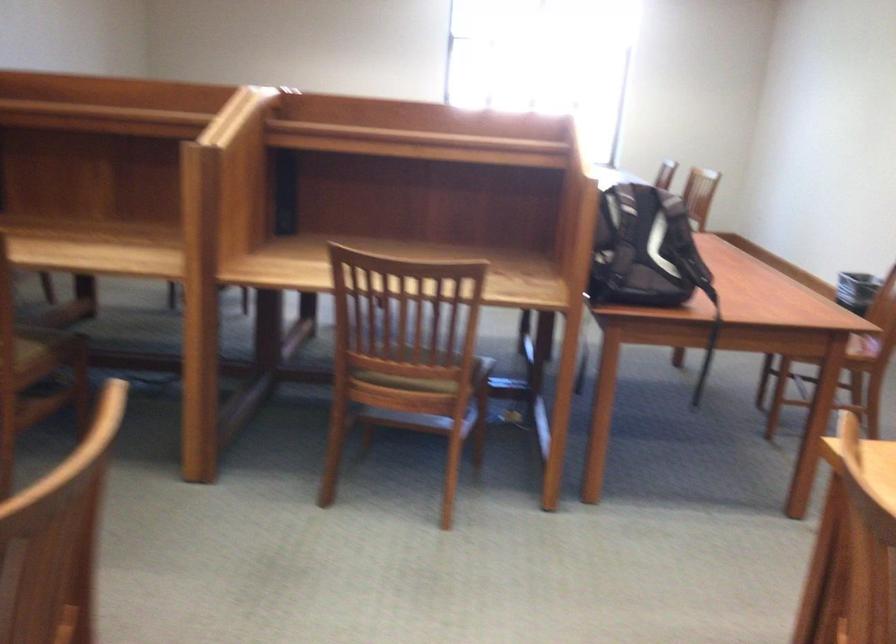
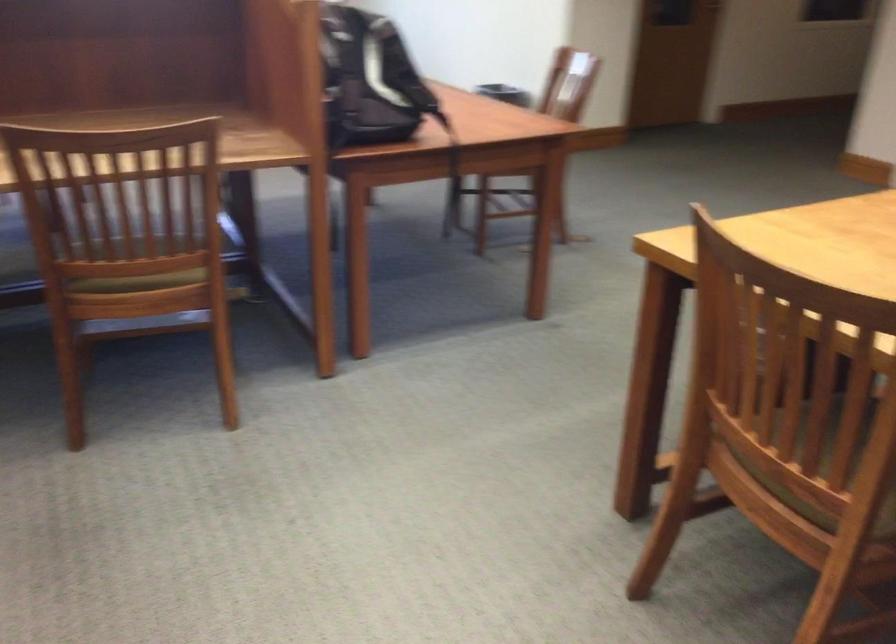
The point at [648,242] is marked in the first image. Where is the corresponding point in the second image?

(371, 80)